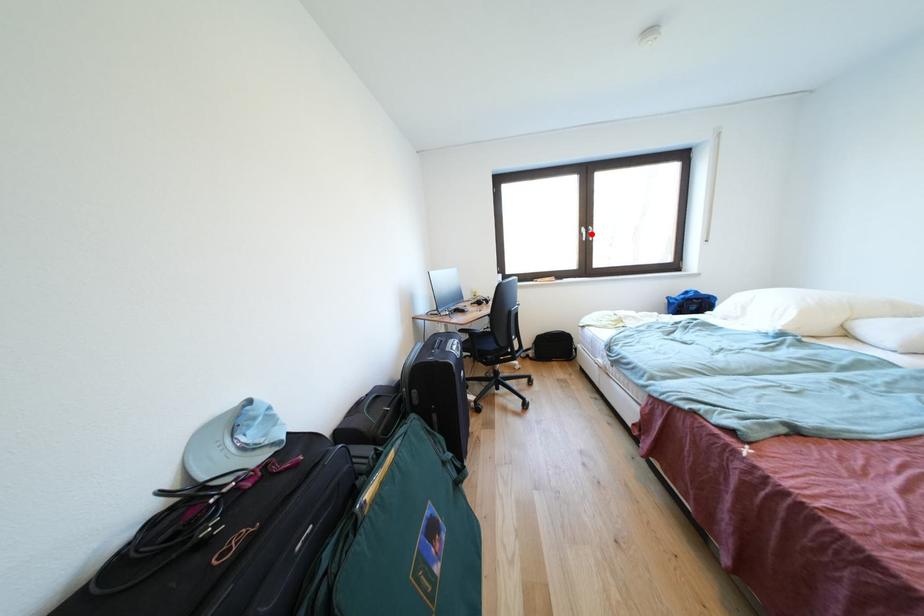
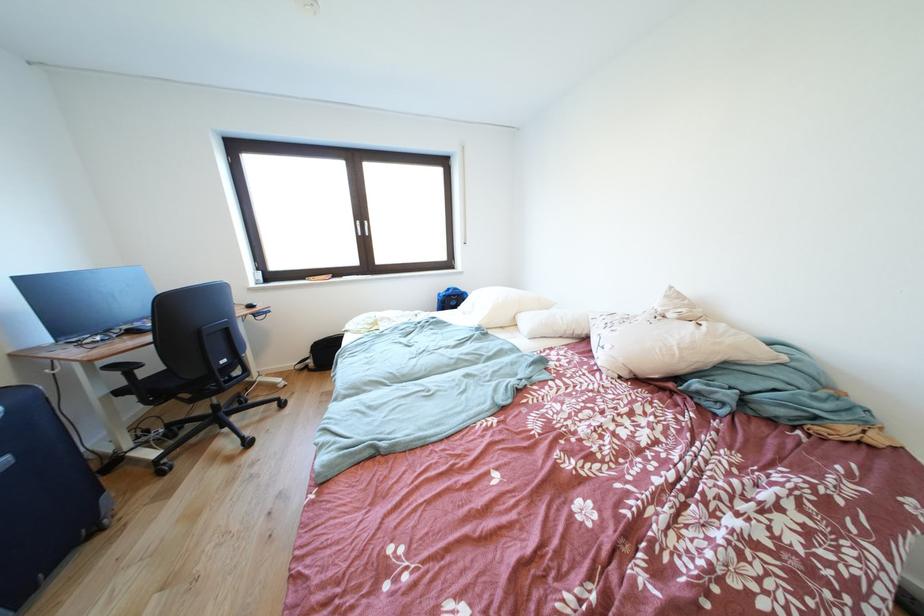
Question: I am providing you with two images of the same scene from different viewpoints. A red point is shown in image1. For the corresponding object point in image2, is it positioned nearer or farther from the camera?

Choices:
 (A) Nearer
 (B) Farther

Answer: (A)